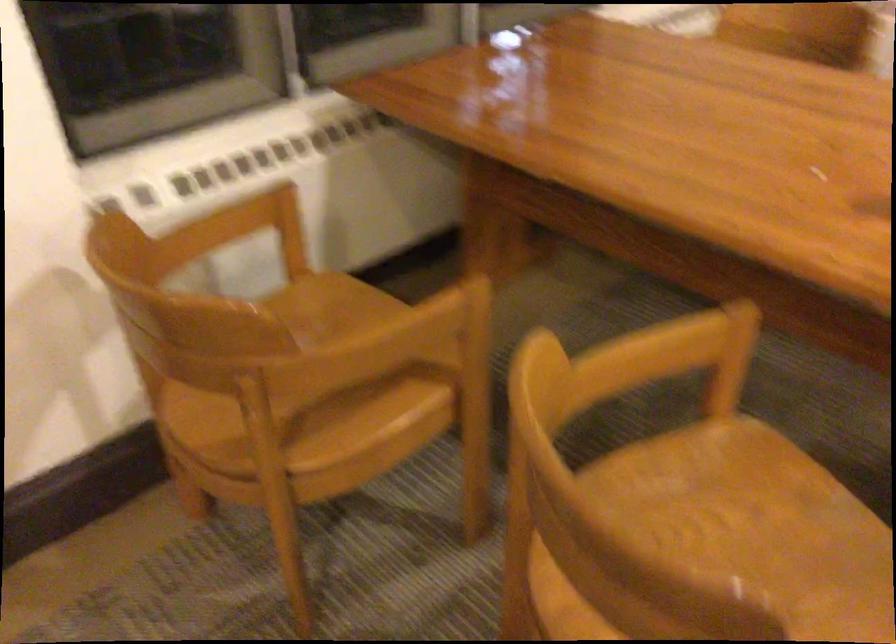
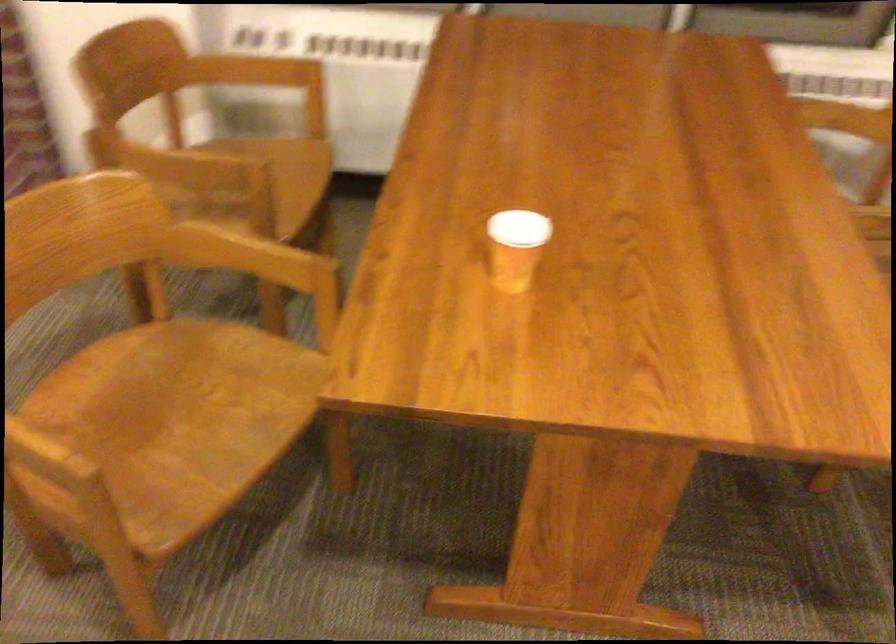
Where in the second image is the point corresponding to (657,353) from the first image?

(248, 257)